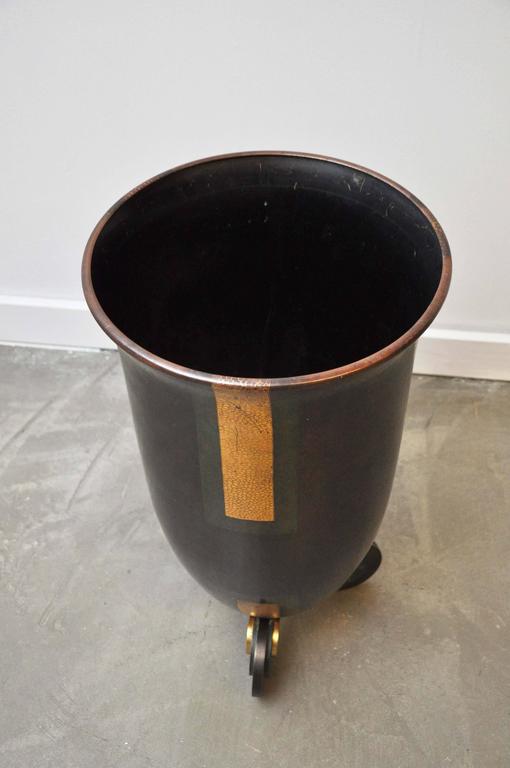
You are a GUI agent. You are given a task and a screenshot of the screen. Output one action in this format:
    pyautogui.click(x=<x>, y=<y>)
    Task: Click on the base board
    
    Given the screenshot: What is the action you would take?
    pyautogui.click(x=68, y=323)